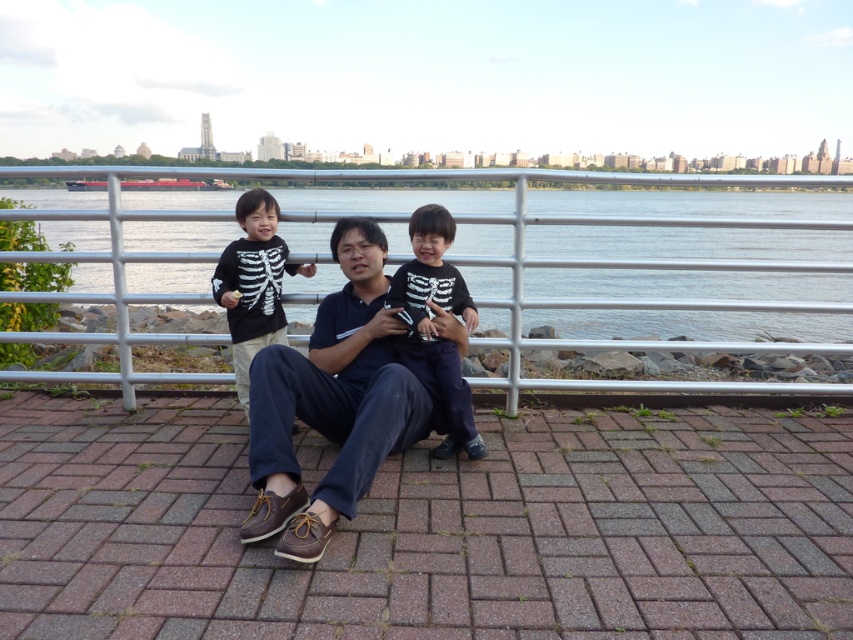
Can you confirm if brown leather shoes at center is smaller than black matte skeleton shirt at center?

Actually, brown leather shoes at center might be larger than black matte skeleton shirt at center.

Does brown leather shoes at center appear on the right side of black matte skeleton shirt at center?

No, brown leather shoes at center is not to the right of black matte skeleton shirt at center.

Locate an element on the screen. Image resolution: width=853 pixels, height=640 pixels. brown leather shoes at center is located at coordinates pos(332,403).

Is blue water at center below black matte skeleton shirt at left?

Actually, blue water at center is above black matte skeleton shirt at left.

Which is more to the left, blue water at center or black matte skeleton shirt at left?

From the viewer's perspective, blue water at center appears more on the left side.

Is point (178, 246) closer to viewer compared to point (238, 388)?

No, (178, 246) is further to viewer.

Where is `blue water at center`? blue water at center is located at coordinates (686, 225).

Can you confirm if blue water at center is wider than black matte skeleton shirt at center?

Yes, blue water at center is wider than black matte skeleton shirt at center.

Who is lower down, blue water at center or black matte skeleton shirt at center?

black matte skeleton shirt at center is lower down.

Between point (395, 240) and point (401, 275), which one is positioned in front?

Point (401, 275) is in front.

Image resolution: width=853 pixels, height=640 pixels. In order to click on blue water at center in this screenshot , I will do `click(686, 225)`.